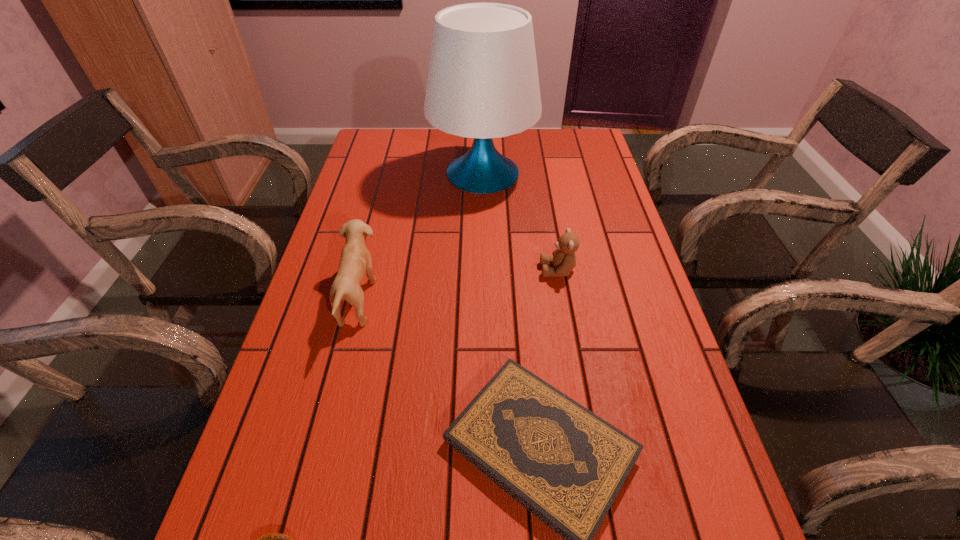
Identify the location of table lamp. This screenshot has height=540, width=960. (482, 83).

Where is `the tallest object`? The width and height of the screenshot is (960, 540). the tallest object is located at coordinates (482, 83).

Locate an element on the screen. puppy is located at coordinates click(x=355, y=261).

Identify the location of the third shortest object. The image size is (960, 540). (564, 258).

The width and height of the screenshot is (960, 540). Identify the location of vacant space located 0.160m on the front-facing side of the table lamp. (379, 173).

Where is `vacant point located 0.210m on the front-facing side of the table lamp`? This screenshot has width=960, height=540. vacant point located 0.210m on the front-facing side of the table lamp is located at coordinates (364, 173).

Image resolution: width=960 pixels, height=540 pixels. I want to click on vacant space positioned 0.220m on the front-facing side of the table lamp, so click(360, 173).

Locate an element on the screen. This screenshot has height=540, width=960. vacant region located 0.300m on the left side of the puppy is located at coordinates (503, 300).

Where is `free space located 0.380m on the front-facing side of the third shortest object`? The height and width of the screenshot is (540, 960). free space located 0.380m on the front-facing side of the third shortest object is located at coordinates (388, 270).

Locate an element on the screen. vacant space located 0.250m on the front-facing side of the third shortest object is located at coordinates point(440,270).